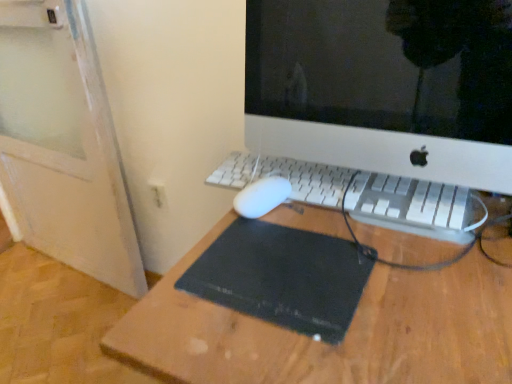
Question: From a real-world perspective, is white plastic keyboard at center on top of black rubber mousepad at center?

Choices:
 (A) yes
 (B) no

Answer: (A)

Question: From a real-world perspective, is white plastic keyboard at center physically below black rubber mousepad at center?

Choices:
 (A) yes
 (B) no

Answer: (B)

Question: Is white plastic keyboard at center wider than black rubber mousepad at center?

Choices:
 (A) yes
 (B) no

Answer: (B)

Question: From the image's perspective, would you say white plastic keyboard at center is shown under black rubber mousepad at center?

Choices:
 (A) yes
 (B) no

Answer: (B)

Question: Considering the relative positions of white plastic keyboard at center and black rubber mousepad at center in the image provided, is white plastic keyboard at center in front of black rubber mousepad at center?

Choices:
 (A) no
 (B) yes

Answer: (A)

Question: Is there a large distance between white plastic keyboard at center and black rubber mousepad at center?

Choices:
 (A) yes
 (B) no

Answer: (B)

Question: Is white plastic electric outlet at lower left positioned before black rubber mousepad at center?

Choices:
 (A) no
 (B) yes

Answer: (A)

Question: From a real-world perspective, is white plastic electric outlet at lower left under black rubber mousepad at center?

Choices:
 (A) yes
 (B) no

Answer: (A)

Question: Does white plastic electric outlet at lower left have a larger size compared to black rubber mousepad at center?

Choices:
 (A) no
 (B) yes

Answer: (A)

Question: Is white plastic electric outlet at lower left wider than black rubber mousepad at center?

Choices:
 (A) yes
 (B) no

Answer: (B)

Question: Would you say white plastic electric outlet at lower left is a long distance from black rubber mousepad at center?

Choices:
 (A) yes
 (B) no

Answer: (B)

Question: Is white plastic electric outlet at lower left aimed at black rubber mousepad at center?

Choices:
 (A) no
 (B) yes

Answer: (A)

Question: From a real-world perspective, is white plastic computer monitor at center positioned over white plastic electric outlet at lower left based on gravity?

Choices:
 (A) no
 (B) yes

Answer: (B)